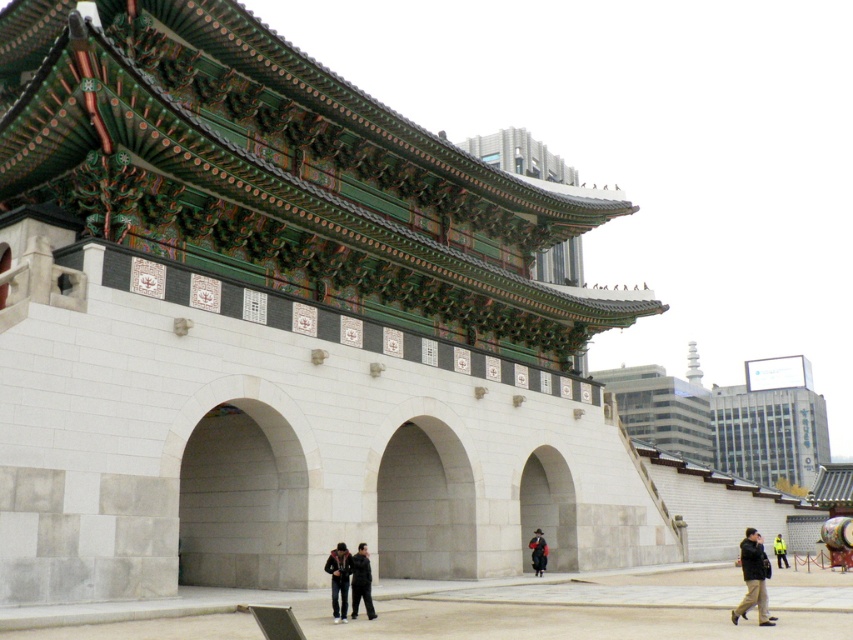
Measure the distance between dark gray jacket at center and yellow reflective jacket at center.

48.54 meters

Between point (370, 605) and point (780, 566), which one is positioned in front?

Positioned in front is point (370, 605).

Image resolution: width=853 pixels, height=640 pixels. I want to click on dark gray jacket at center, so click(361, 580).

Who is higher up, dark blue jacket at center or yellow reflective jacket at center?

dark blue jacket at center

Where is `dark blue jacket at center`? The width and height of the screenshot is (853, 640). dark blue jacket at center is located at coordinates (338, 579).

Who is more distant from viewer, [343,547] or [782,545]?

The point [782,545] is behind.

Find the location of a particular element. This screenshot has height=640, width=853. dark blue jacket at center is located at coordinates (338, 579).

Which is more to the right, dark gray jacket at lower right or yellow reflective jacket at center?

Positioned to the right is yellow reflective jacket at center.

Does dark gray jacket at lower right have a greater height compared to yellow reflective jacket at center?

Indeed, dark gray jacket at lower right has a greater height compared to yellow reflective jacket at center.

This screenshot has height=640, width=853. I want to click on dark gray jacket at lower right, so click(x=752, y=577).